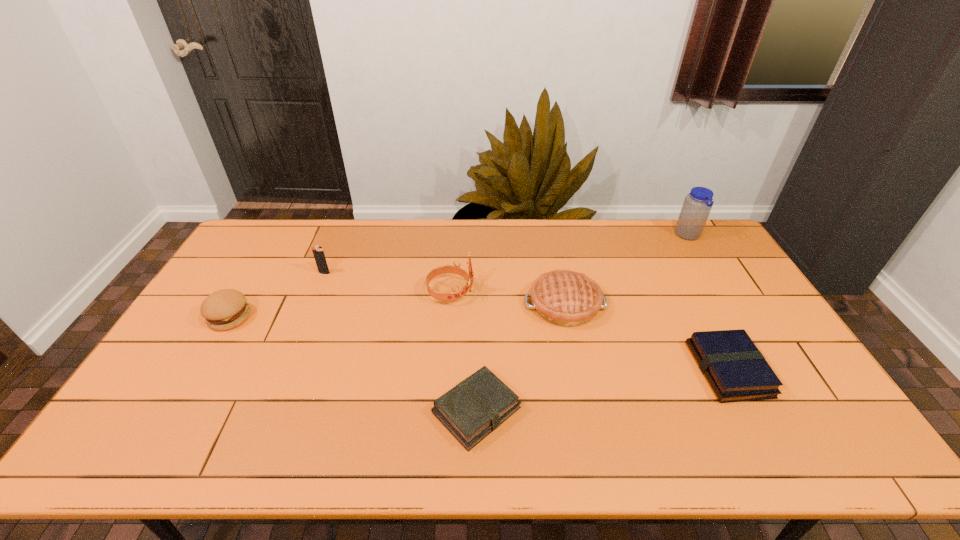
Find the location of `blank space that satisfies the following two spatial constraints: 1. on the front-facing side of the pie; 2. on the left side of the tiara`. blank space that satisfies the following two spatial constraints: 1. on the front-facing side of the pie; 2. on the left side of the tiara is located at coordinates (450, 305).

You are a GUI agent. You are given a task and a screenshot of the screen. Output one action in this format:
    pyautogui.click(x=<x>, y=<y>)
    Task: Click on the free location that satisfies the following two spatial constraints: 1. on the front-facing side of the tiara; 2. on the front side of the leftmost object
    
    Given the screenshot: What is the action you would take?
    pyautogui.click(x=449, y=317)

You are a GUI agent. You are given a task and a screenshot of the screen. Output one action in this format:
    pyautogui.click(x=<x>, y=<y>)
    Task: Click on the blank area in the image that satisfies the following two spatial constraints: 1. on the front-facing side of the tiara; 2. on the left side of the third object from right to left
    This screenshot has height=540, width=960.
    Given the screenshot: What is the action you would take?
    pyautogui.click(x=450, y=305)

Locate an element on the screen. The width and height of the screenshot is (960, 540). free region that satisfies the following two spatial constraints: 1. on the front-facing side of the tiara; 2. on the left side of the pie is located at coordinates (450, 305).

Image resolution: width=960 pixels, height=540 pixels. I want to click on vacant point that satisfies the following two spatial constraints: 1. on the back side of the third object from right to left; 2. on the right side of the left book, so click(x=477, y=305).